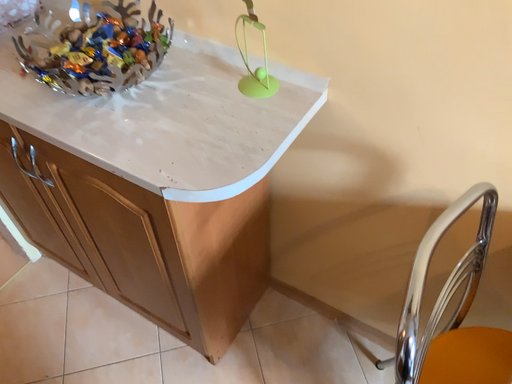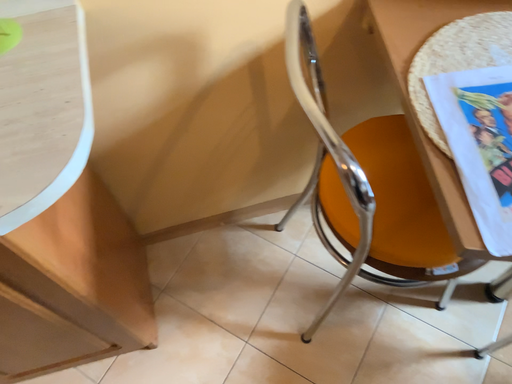
Question: How did the camera likely rotate when shooting the video?

Choices:
 (A) rotated left
 (B) rotated right

Answer: (B)